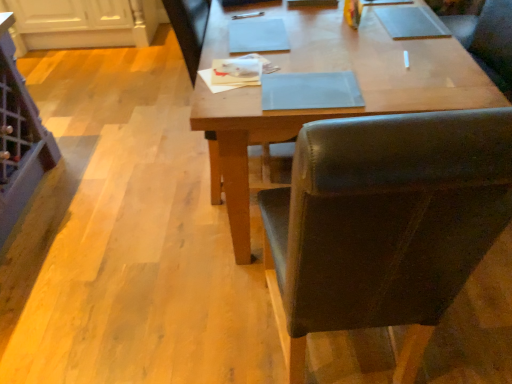
Question: Does wooden desk at center have a greater height compared to brown leather chair at center?

Choices:
 (A) no
 (B) yes

Answer: (A)

Question: Is wooden desk at center next to brown leather chair at center?

Choices:
 (A) yes
 (B) no

Answer: (B)

Question: Is wooden desk at center shorter than brown leather chair at center?

Choices:
 (A) no
 (B) yes

Answer: (B)

Question: Is wooden desk at center bigger than brown leather chair at center?

Choices:
 (A) no
 (B) yes

Answer: (B)

Question: Is wooden desk at center positioned beyond the bounds of brown leather chair at center?

Choices:
 (A) no
 (B) yes

Answer: (B)

Question: Would you consider wooden desk at center to be distant from brown leather chair at center?

Choices:
 (A) no
 (B) yes

Answer: (A)

Question: Does brown leather chair at center have a larger size compared to wooden desk at center?

Choices:
 (A) yes
 (B) no

Answer: (B)

Question: From the image's perspective, is brown leather chair at center under wooden desk at center?

Choices:
 (A) no
 (B) yes

Answer: (B)

Question: From the image's perspective, would you say brown leather chair at center is positioned over wooden desk at center?

Choices:
 (A) no
 (B) yes

Answer: (A)

Question: Could wooden desk at center be considered to be inside brown leather chair at center?

Choices:
 (A) yes
 (B) no

Answer: (B)

Question: Can you confirm if brown leather chair at center is shorter than wooden desk at center?

Choices:
 (A) yes
 (B) no

Answer: (B)

Question: From a real-world perspective, is brown leather chair at center below wooden desk at center?

Choices:
 (A) no
 (B) yes

Answer: (A)

Question: Considering the relative positions of brown leather chair at center and wooden desk at center in the image provided, is brown leather chair at center to the left or to the right of wooden desk at center?

Choices:
 (A) right
 (B) left

Answer: (B)